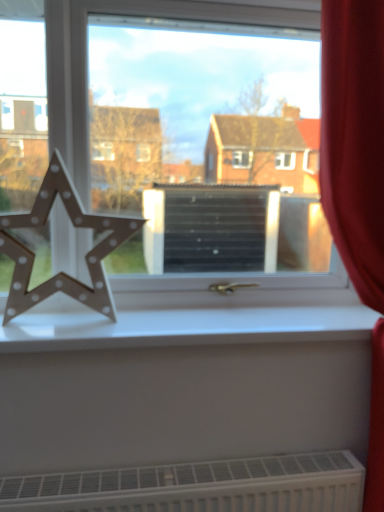
The image size is (384, 512). What do you see at coordinates (75, 226) in the screenshot?
I see `wooden star at left` at bounding box center [75, 226].

In order to face metallic star at left, should I rotate leftwards or rightwards?

It's best to rotate left around 0.739 degrees.

The image size is (384, 512). Identify the location of wooden star at left. (75, 226).

Is wooden star at left oriented towards metallic star at left?

No, wooden star at left is not facing towards metallic star at left.

Which object is thinner, wooden star at left or metallic star at left?

metallic star at left is thinner.

Considering the sizes of objects metallic star at left and red velvet curtain at right in the image provided, who is bigger, metallic star at left or red velvet curtain at right?

red velvet curtain at right is bigger.

Is metallic star at left not close to red velvet curtain at right?

No, metallic star at left is not far away from red velvet curtain at right.

Consider the image. From the image's perspective, is metallic star at left below red velvet curtain at right?

Actually, metallic star at left appears above red velvet curtain at right in the image.

Who is shorter, white matte window sill at center or red velvet curtain at right?

white matte window sill at center is shorter.

Looking at their sizes, would you say white matte window sill at center is wider or thinner than red velvet curtain at right?

Considering their sizes, white matte window sill at center looks slimmer than red velvet curtain at right.

How different are the orientations of white matte window sill at center and red velvet curtain at right in degrees?

The facing directions of white matte window sill at center and red velvet curtain at right are 2.26 degrees apart.

From a real-world perspective, is white matte window sill at center physically above red velvet curtain at right?

Incorrect, from a real-world perspective, white matte window sill at center is lower than red velvet curtain at right.

Is point (364, 103) closer to viewer compared to point (244, 277)?

Yes, it is in front of point (244, 277).

How many degrees apart are the facing directions of red velvet curtain at right and metallic star at left?

There is a 2.34-degree angle between the facing directions of red velvet curtain at right and metallic star at left.

Would you say red velvet curtain at right contains metallic star at left?

Actually, metallic star at left is outside red velvet curtain at right.

Considering their positions, is red velvet curtain at right located in front of or behind metallic star at left?

In the image, red velvet curtain at right appears in front of metallic star at left.

Is point (39, 285) closer or farther from the camera than point (88, 323)?

Clearly, point (39, 285) is more distant from the camera than point (88, 323).

Considering the relative sizes of wooden star at left and white matte window sill at center in the image provided, is wooden star at left thinner than white matte window sill at center?

Yes, wooden star at left is thinner than white matte window sill at center.

Considering the sizes of objects metallic star at left and wooden star at left in the image provided, who is thinner, metallic star at left or wooden star at left?

With smaller width is metallic star at left.

Locate an element on the screen. Image resolution: width=384 pixels, height=512 pixels. window lying above the wooden star at left (from the image's perspective) is located at coordinates (180, 169).

Can you confirm if metallic star at left is shorter than wooden star at left?

No.

Find the location of a particular element. The width and height of the screenshot is (384, 512). curtain on the right of wooden star at left is located at coordinates click(x=354, y=139).

Which of these two, red velvet curtain at right or wooden star at left, stands shorter?

With less height is wooden star at left.

The width and height of the screenshot is (384, 512). In order to click on window above the wooden star at left (from a real-world perspective) in this screenshot , I will do (x=180, y=169).

At what (x,y) coordinates should I click in order to perform the action: click on window that appears on the left of red velvet curtain at right. Please return your answer as a coordinate pair (x, y). Image resolution: width=384 pixels, height=512 pixels. Looking at the image, I should click on (x=180, y=169).

Which object lies further to the anchor point white matte window sill at center, red velvet curtain at right or metallic star at left?

red velvet curtain at right is positioned further to the anchor white matte window sill at center.

Which object lies further to the anchor point metallic star at left, red velvet curtain at right or white matte window sill at center?

red velvet curtain at right.

Which object lies further to the anchor point red velvet curtain at right, white matte window sill at center or wooden star at left?

wooden star at left is positioned further to the anchor red velvet curtain at right.

From the image, which object appears to be nearer to metallic star at left, red velvet curtain at right or wooden star at left?

wooden star at left lies closer to metallic star at left than the other object.

Which object lies further to the anchor point red velvet curtain at right, metallic star at left or wooden star at left?

wooden star at left is further to red velvet curtain at right.

From the image, which object appears to be nearer to red velvet curtain at right, white matte window sill at center or metallic star at left?

white matte window sill at center lies closer to red velvet curtain at right than the other object.

From the image, which object appears to be farther from white matte window sill at center, wooden star at left or metallic star at left?

metallic star at left lies further to white matte window sill at center than the other object.

Looking at this image, considering their positions, is red velvet curtain at right positioned further to white matte window sill at center than wooden star at left?

red velvet curtain at right lies further to white matte window sill at center than the other object.

The image size is (384, 512). I want to click on curtain between metallic star at left and white matte window sill at center from top to bottom, so click(354, 139).

What are the coordinates of `window sill between wooden star at left and red velvet curtain at right in the horizontal direction` in the screenshot? It's located at (184, 327).

The height and width of the screenshot is (512, 384). What are the coordinates of `window between wooden star at left and red velvet curtain at right in the horizontal direction` in the screenshot? It's located at (180, 169).

Image resolution: width=384 pixels, height=512 pixels. I want to click on letter between metallic star at left and white matte window sill at center in the vertical direction, so click(75, 226).